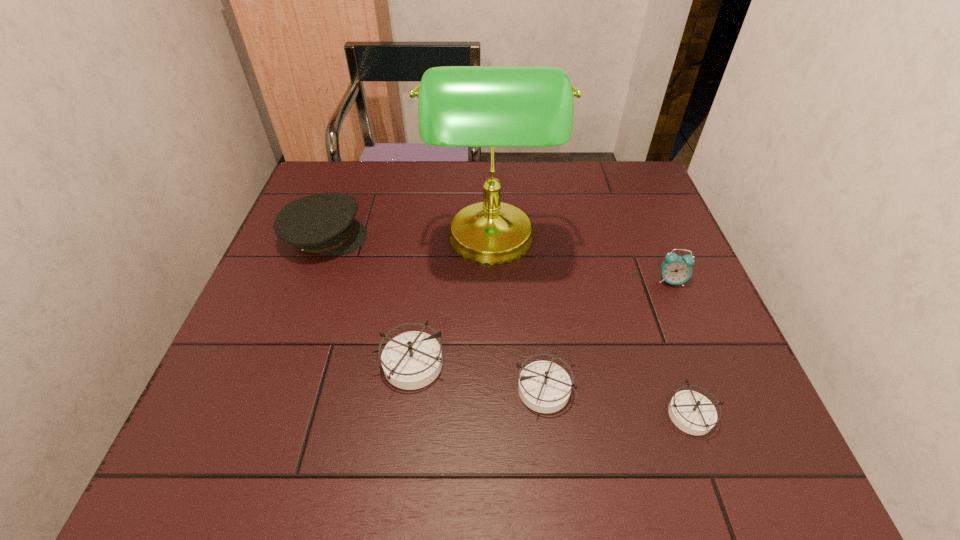
Locate an element on the screen. the tallest compass is located at coordinates (411, 360).

You are a GUI agent. You are given a task and a screenshot of the screen. Output one action in this format:
    pyautogui.click(x=<x>, y=<y>)
    Task: Click on the second tallest compass
    The height and width of the screenshot is (540, 960).
    Given the screenshot: What is the action you would take?
    pyautogui.click(x=545, y=387)

Locate an element on the screen. The height and width of the screenshot is (540, 960). the second shortest object is located at coordinates (545, 387).

The height and width of the screenshot is (540, 960). I want to click on the shortest compass, so (693, 413).

What are the coordinates of `the shortest object` in the screenshot? It's located at (693, 413).

Locate an element on the screen. the tallest object is located at coordinates (458, 106).

In order to click on beret in this screenshot , I will do `click(323, 223)`.

The height and width of the screenshot is (540, 960). I want to click on alarm clock, so click(675, 269).

This screenshot has width=960, height=540. In order to click on vacant position located on the left of the tallest compass in this screenshot , I will do `click(246, 364)`.

You are a GUI agent. You are given a task and a screenshot of the screen. Output one action in this format:
    pyautogui.click(x=<x>, y=<y>)
    Task: Click on the free region located 0.170m on the right of the second shortest object
    
    Given the screenshot: What is the action you would take?
    pyautogui.click(x=660, y=388)